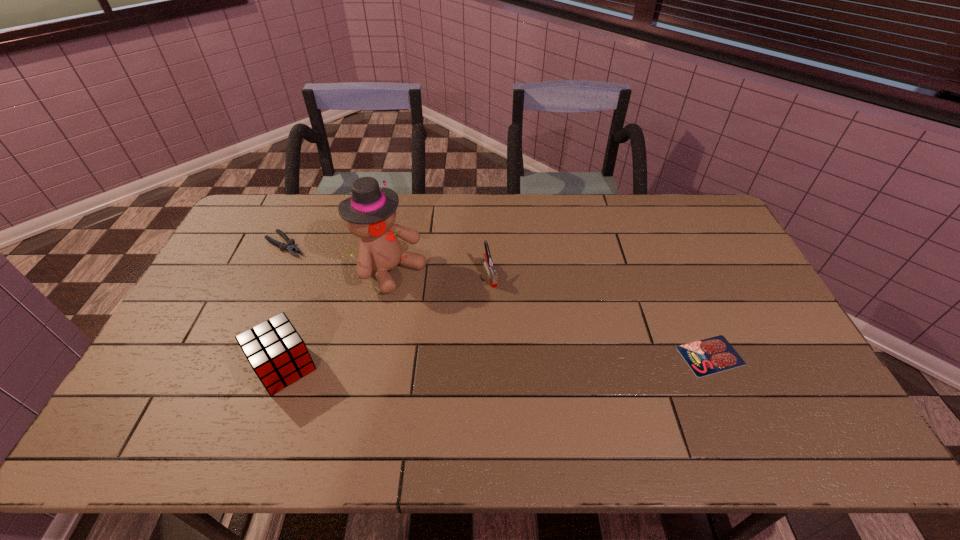
The height and width of the screenshot is (540, 960). What are the coordinates of `cube at the near edge` in the screenshot? It's located at (278, 355).

The width and height of the screenshot is (960, 540). What are the coordinates of `salami located at the near edge` in the screenshot? It's located at (712, 355).

Find the location of a particular element. The image size is (960, 540). object that is at the left edge is located at coordinates (290, 247).

Where is `object located in the right edge section of the desktop`? object located in the right edge section of the desktop is located at coordinates (712, 355).

I want to click on object that is at the far left corner, so click(290, 247).

Image resolution: width=960 pixels, height=540 pixels. Identify the location of object located in the near right corner section of the desktop. (712, 355).

Image resolution: width=960 pixels, height=540 pixels. I want to click on free region at the far edge of the desktop, so click(582, 215).

You are a GUI agent. You are given a task and a screenshot of the screen. Output one action in this format:
    pyautogui.click(x=<x>, y=<y>)
    Task: Click on the vacant point at the near edge
    The height and width of the screenshot is (540, 960).
    Given the screenshot: What is the action you would take?
    point(668,378)

You are a GUI agent. You are given a task and a screenshot of the screen. Output one action in this format:
    pyautogui.click(x=<x>, y=<y>)
    Task: Click on the vacant space at the right edge of the desktop
    This screenshot has width=960, height=540.
    Given the screenshot: What is the action you would take?
    pyautogui.click(x=758, y=348)

At what (x,y) coordinates should I click in order to perform the action: click on vacant region at the far left corner. Please return your answer as a coordinate pair (x, y). Looking at the image, I should click on (262, 204).